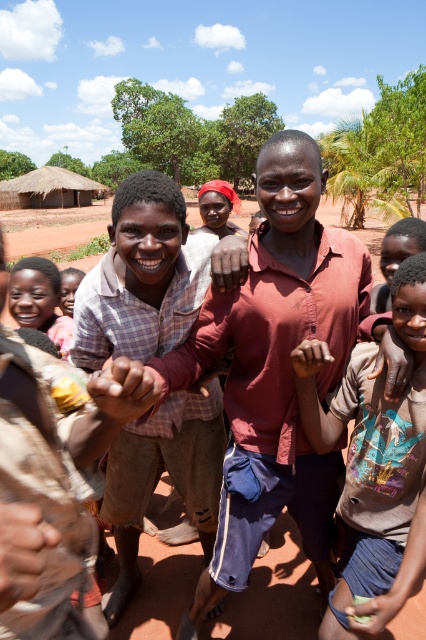
Question: Which point is farther to the camera?

Choices:
 (A) (104, 355)
 (B) (319, 580)

Answer: (B)

Question: Estimate the real-world distances between objects in this image. Which object is closer to the plaid fabric shirt at center?

Choices:
 (A) light brown cotton shirt at center
 (B) matte red shirt at center

Answer: (B)

Question: Which object is positioned closest to the plaid fabric shirt at center?

Choices:
 (A) light brown cotton shirt at center
 (B) matte red shirt at center

Answer: (B)

Question: Is plaid fabric shirt at center smaller than light brown cotton shirt at center?

Choices:
 (A) no
 (B) yes

Answer: (A)

Question: Does matte red shirt at center have a larger size compared to plaid fabric shirt at center?

Choices:
 (A) no
 (B) yes

Answer: (B)

Question: Is matte red shirt at center to the left of plaid fabric shirt at center from the viewer's perspective?

Choices:
 (A) yes
 (B) no

Answer: (B)